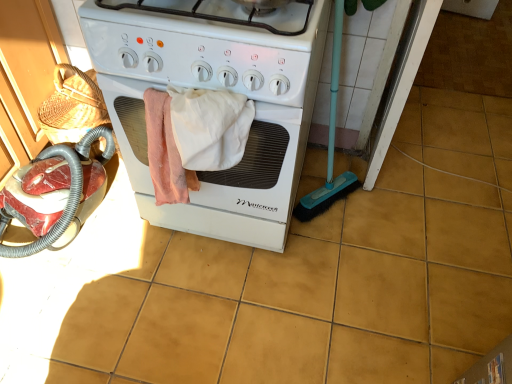
Question: Is yellow matte tile at center thinner than white glossy gas stove at center?

Choices:
 (A) yes
 (B) no

Answer: (A)

Question: Are yellow matte tile at center and white glossy gas stove at center located far from each other?

Choices:
 (A) yes
 (B) no

Answer: (A)

Question: Considering the relative sizes of yellow matte tile at center and white glossy gas stove at center in the image provided, is yellow matte tile at center shorter than white glossy gas stove at center?

Choices:
 (A) no
 (B) yes

Answer: (B)

Question: Is yellow matte tile at center in front of white glossy gas stove at center?

Choices:
 (A) yes
 (B) no

Answer: (B)

Question: From a real-world perspective, is yellow matte tile at center physically below white glossy gas stove at center?

Choices:
 (A) no
 (B) yes

Answer: (B)

Question: Is yellow matte tile at center further to camera compared to white glossy gas stove at center?

Choices:
 (A) yes
 (B) no

Answer: (A)

Question: Considering the relative sizes of white cotton towel at center and white glossy gas stove at center in the image provided, is white cotton towel at center bigger than white glossy gas stove at center?

Choices:
 (A) yes
 (B) no

Answer: (B)

Question: From the image's perspective, is white cotton towel at center beneath white glossy gas stove at center?

Choices:
 (A) no
 (B) yes

Answer: (B)

Question: Considering the relative sizes of white cotton towel at center and white glossy gas stove at center in the image provided, is white cotton towel at center wider than white glossy gas stove at center?

Choices:
 (A) no
 (B) yes

Answer: (A)

Question: Are white cotton towel at center and white glossy gas stove at center located far from each other?

Choices:
 (A) yes
 (B) no

Answer: (B)

Question: Is white glossy gas stove at center at the back of white cotton towel at center?

Choices:
 (A) no
 (B) yes

Answer: (B)

Question: From a real-world perspective, is white cotton towel at center physically below white glossy gas stove at center?

Choices:
 (A) no
 (B) yes

Answer: (B)

Question: From a real-world perspective, is white cotton towel at center located beneath yellow matte tile at center?

Choices:
 (A) no
 (B) yes

Answer: (A)